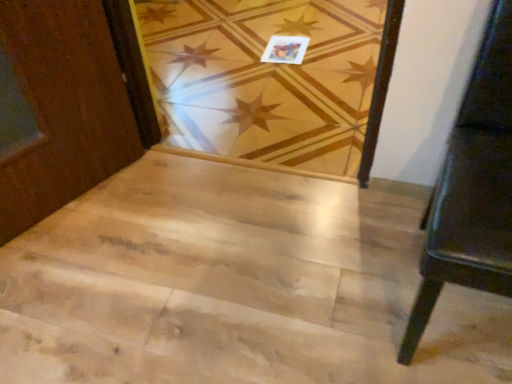
Question: Can you confirm if matte paper postcard at upper center is thinner than natural wood floor at center?

Choices:
 (A) yes
 (B) no

Answer: (A)

Question: From a real-world perspective, is matte paper postcard at upper center beneath natural wood floor at center?

Choices:
 (A) no
 (B) yes

Answer: (A)

Question: From the image's perspective, would you say matte paper postcard at upper center is shown under natural wood floor at center?

Choices:
 (A) no
 (B) yes

Answer: (B)

Question: Can you confirm if matte paper postcard at upper center is positioned to the left of natural wood floor at center?

Choices:
 (A) no
 (B) yes

Answer: (A)

Question: Is matte paper postcard at upper center facing towards natural wood floor at center?

Choices:
 (A) yes
 (B) no

Answer: (A)

Question: Based on their sizes in the image, would you say matte paper postcard at upper center is bigger or smaller than black leather bench at right?

Choices:
 (A) big
 (B) small

Answer: (B)

Question: Considering the relative positions of matte paper postcard at upper center and black leather bench at right in the image provided, is matte paper postcard at upper center to the left or to the right of black leather bench at right?

Choices:
 (A) left
 (B) right

Answer: (A)

Question: Is matte paper postcard at upper center inside or outside of black leather bench at right?

Choices:
 (A) outside
 (B) inside

Answer: (A)

Question: Is point click(275, 56) positioned closer to the camera than point click(507, 296)?

Choices:
 (A) farther
 (B) closer

Answer: (A)

Question: From a real-world perspective, is natural wood stairwell at center physically located above or below matte paper postcard at upper center?

Choices:
 (A) above
 (B) below

Answer: (B)

Question: Considering the positions of point (128, 288) and point (298, 46), is point (128, 288) closer or farther from the camera than point (298, 46)?

Choices:
 (A) closer
 (B) farther

Answer: (A)

Question: Relative to matte paper postcard at upper center, is natural wood stairwell at center in front or behind?

Choices:
 (A) front
 (B) behind

Answer: (A)

Question: Is natural wood stairwell at center to the left or to the right of matte paper postcard at upper center in the image?

Choices:
 (A) left
 (B) right

Answer: (A)

Question: Based on their positions, is black leather bench at right located to the left or right of natural wood stairwell at center?

Choices:
 (A) right
 (B) left

Answer: (A)

Question: Considering the positions of point (496, 44) and point (6, 297), is point (496, 44) closer or farther from the camera than point (6, 297)?

Choices:
 (A) closer
 (B) farther

Answer: (A)